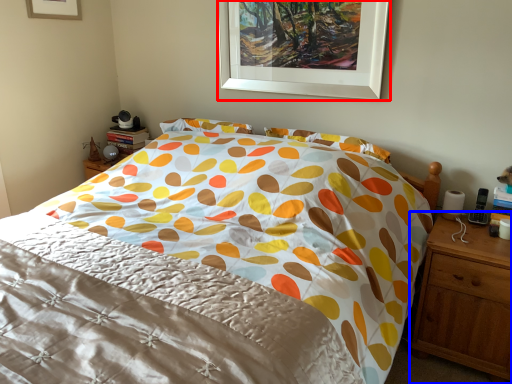
Question: Which object appears closest to the camera in this image, picture frame (highlighted by a red box) or nightstand (highlighted by a blue box)?

Choices:
 (A) picture frame
 (B) nightstand

Answer: (B)